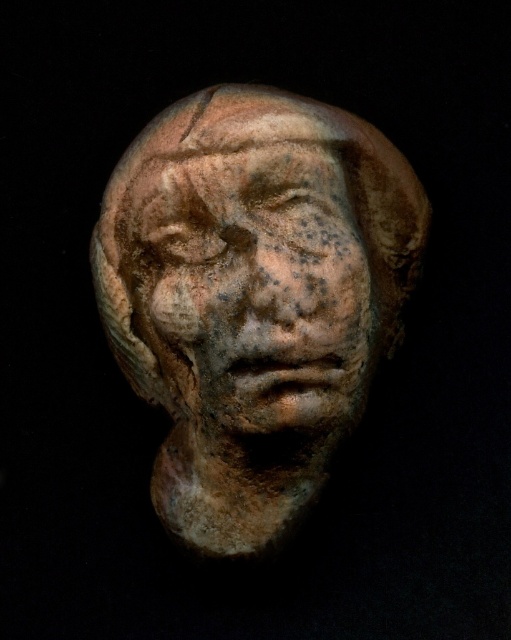
Question: Which object appears closest to the camera in this image?

Choices:
 (A) matte clay head at center
 (B) earthenware sculpture at center

Answer: (B)

Question: Is matte clay head at center thinner than earthenware sculpture at center?

Choices:
 (A) yes
 (B) no

Answer: (B)

Question: In this image, where is matte clay head at center located relative to earthenware sculpture at center?

Choices:
 (A) below
 (B) above

Answer: (A)

Question: Which point is farther from the camera taking this photo?

Choices:
 (A) (x=332, y=369)
 (B) (x=257, y=260)

Answer: (A)

Question: Does matte clay head at center come behind earthenware sculpture at center?

Choices:
 (A) yes
 (B) no

Answer: (A)